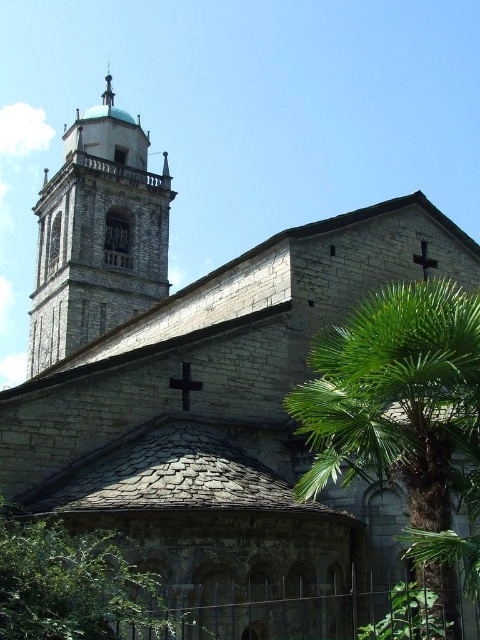
Question: Considering the relative positions of black stone cross at upper center and polished silver spire at upper center in the image provided, where is black stone cross at upper center located with respect to polished silver spire at upper center?

Choices:
 (A) left
 (B) right

Answer: (B)

Question: Can you confirm if gray stone tower at left is wider than black stone cross at upper center?

Choices:
 (A) no
 (B) yes

Answer: (B)

Question: Does green leafy palm tree at right appear on the right side of polished silver spire at upper center?

Choices:
 (A) yes
 (B) no

Answer: (A)

Question: Estimate the real-world distances between objects in this image. Which object is farther from the green leafy tree at lower center?

Choices:
 (A) gray stone tower at left
 (B) green leafy palm tree at right
 (C) polished silver spire at upper center
 (D) black stone cross at upper center

Answer: (C)

Question: Which point is closer to the camera?

Choices:
 (A) (100, 148)
 (B) (49, 557)
 (C) (110, 92)

Answer: (B)

Question: Among these points, which one is farthest from the camera?

Choices:
 (A) (382, 440)
 (B) (136, 122)
 (C) (39, 576)

Answer: (B)